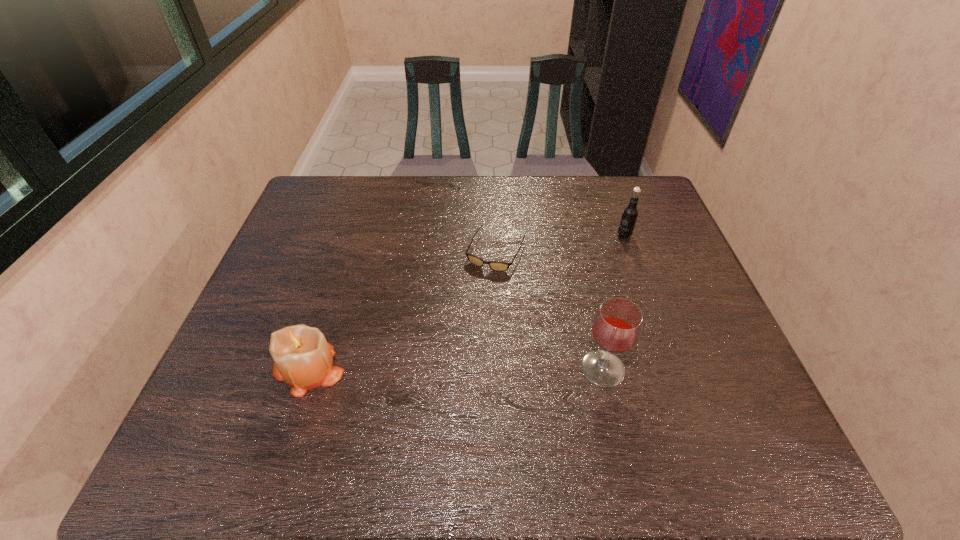
Locate an element on the screen. vacant space on the desktop that is between the candle and the third object from left to right and is positioned on the front-facing side of the shortest object is located at coordinates (437, 369).

At what (x,y) coordinates should I click in order to perform the action: click on free space on the desktop that is between the leftmost object and the second object from right to left and is positioned on the label of the rightmost object. Please return your answer as a coordinate pair (x, y). Looking at the image, I should click on (498, 368).